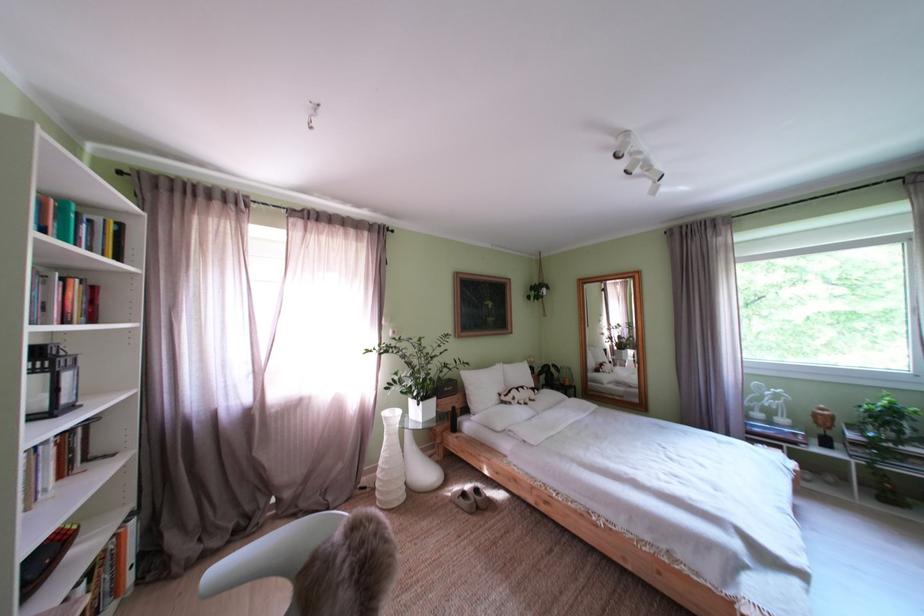
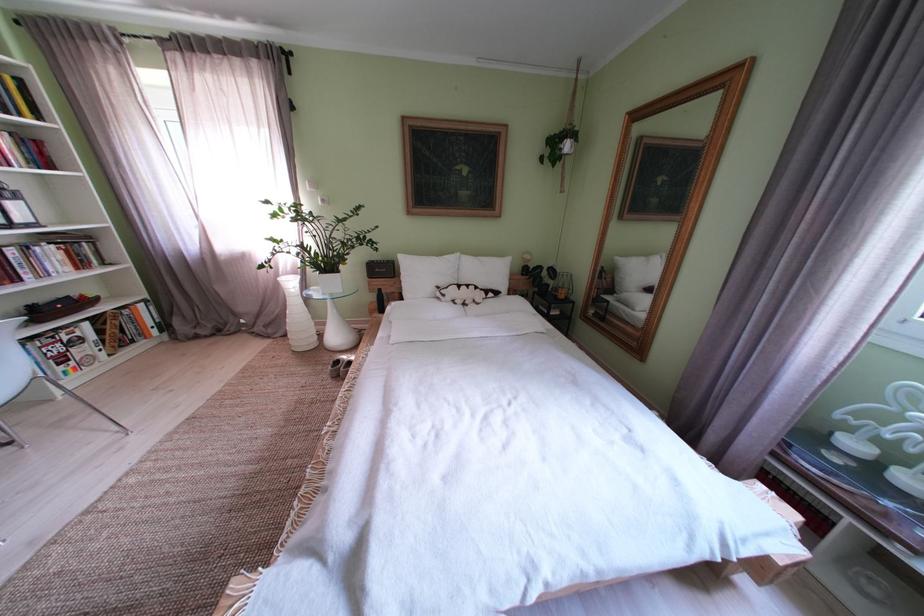
Locate, in the second image, the point that corresponds to (x=492, y=392) in the first image.

(429, 280)